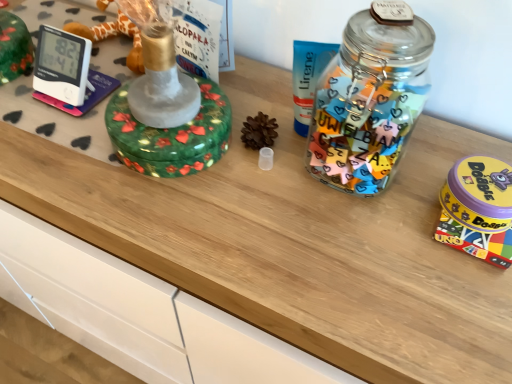
The width and height of the screenshot is (512, 384). I want to click on vacant position to the left of yellow plastic game at right, the 2th toy when ordered from left to right, so [352, 220].